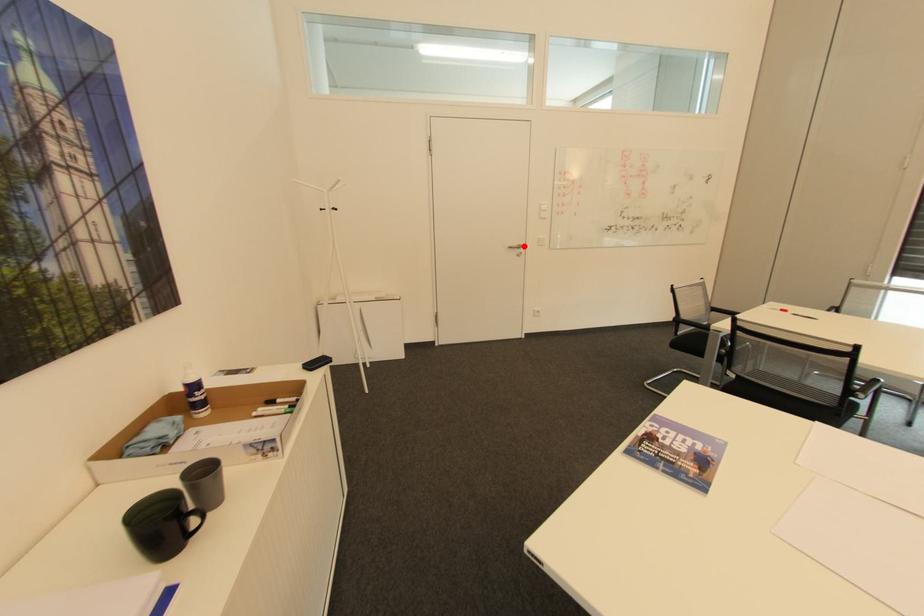
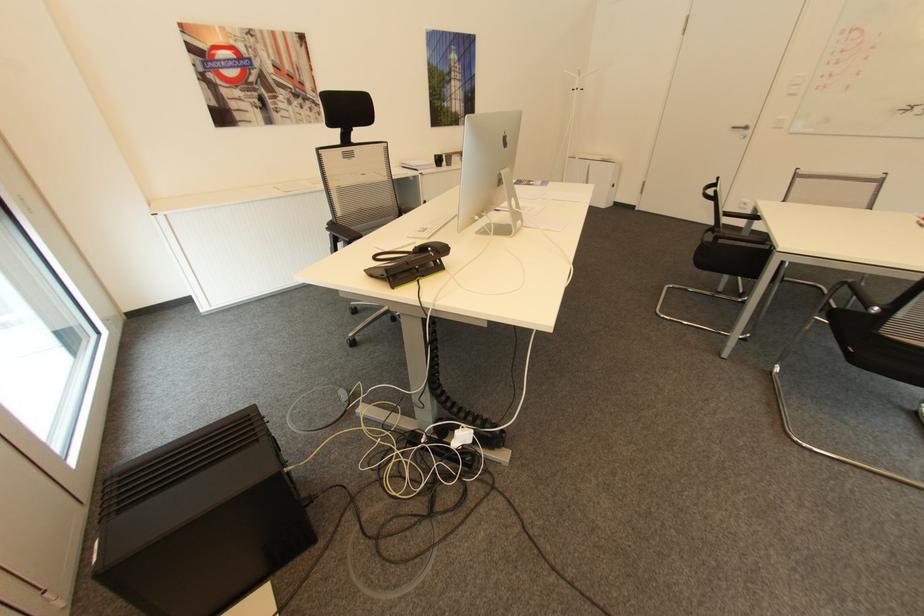
Question: I am providing you with two images of the same scene from different viewpoints. In image1, a red point is highlighted. Considering the same 3D point in image2, which of the following is correct?

Choices:
 (A) It is closer
 (B) It is farther

Answer: (B)